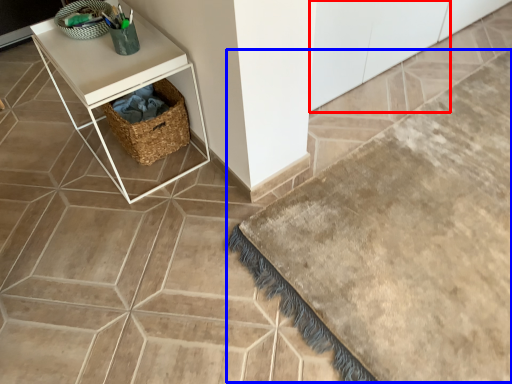
Question: Which point is further to the camera, cabinetry (highlighted by a red box) or bath mat (highlighted by a blue box)?

Choices:
 (A) cabinetry
 (B) bath mat

Answer: (A)